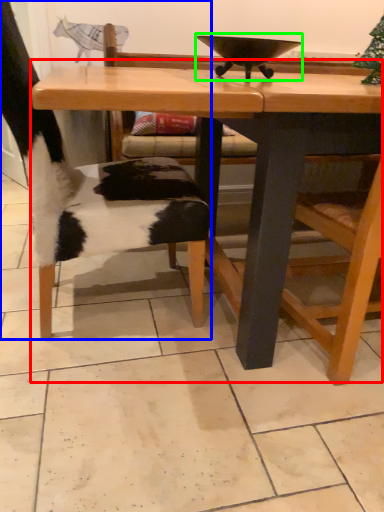
Question: Estimate the real-world distances between objects in this image. Which object is closer to table (highlighted by a red box), chair (highlighted by a blue box) or bowl (highlighted by a green box)?

Choices:
 (A) chair
 (B) bowl

Answer: (A)